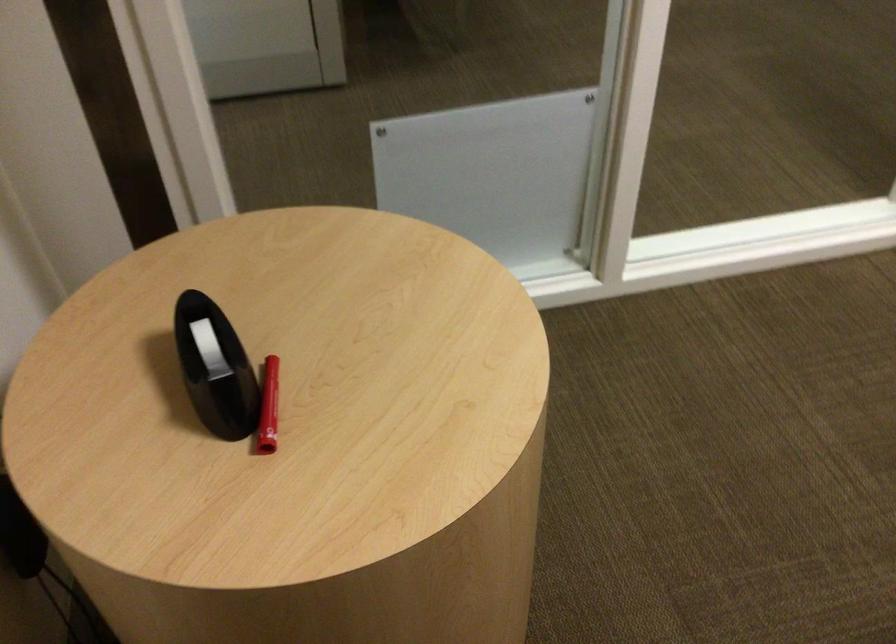
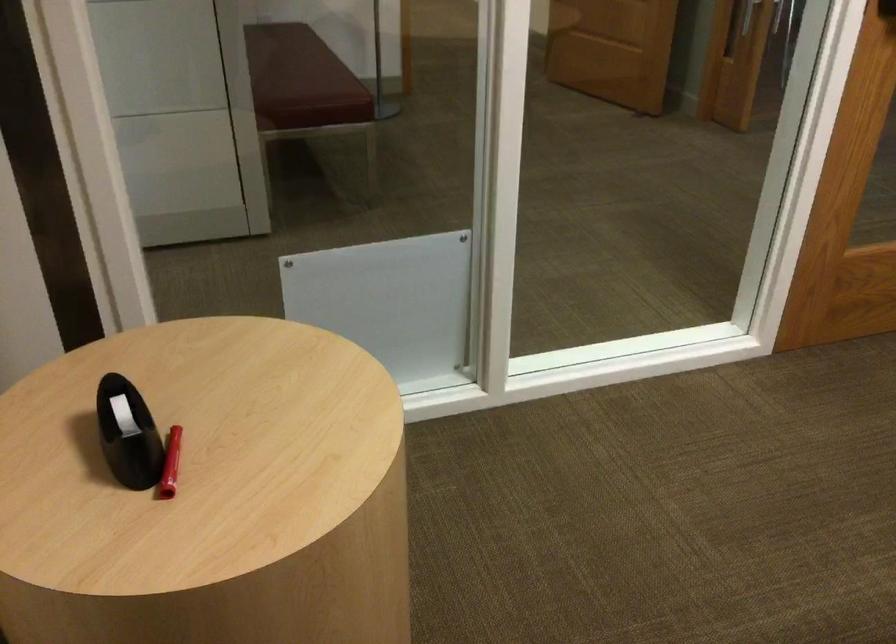
Where in the second image is the point corresponding to pixel 271 406 from the first image?

(170, 464)